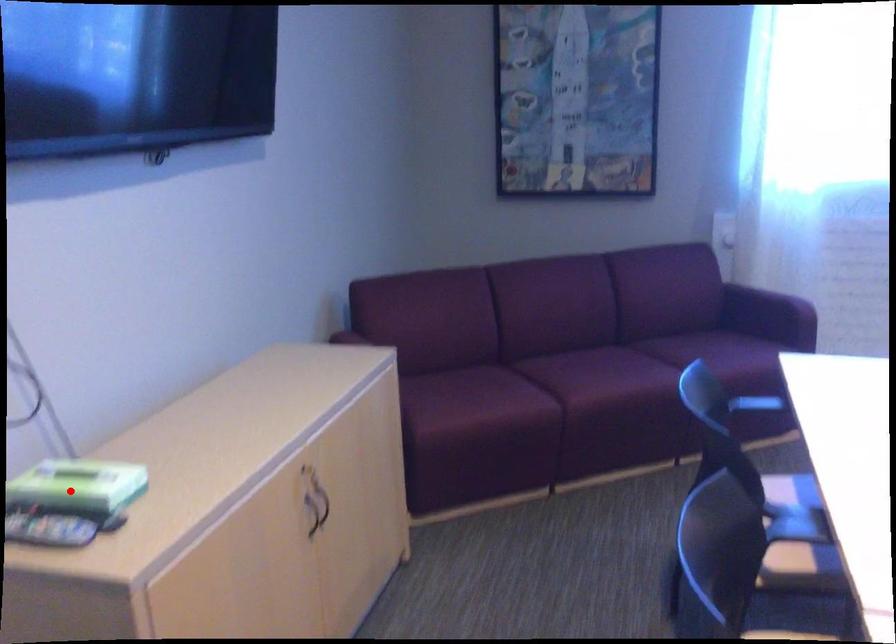
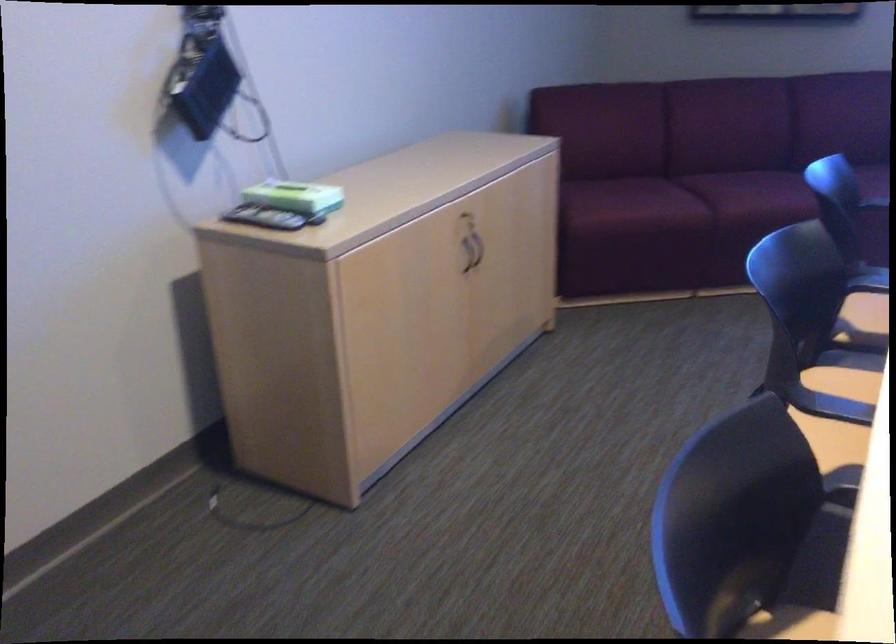
Question: I am providing you with two images of the same scene from different viewpoints. A red point is marked on the first image. At the location where the point appears in image 1, is it still visible in image 2?

Choices:
 (A) Yes
 (B) No

Answer: (A)